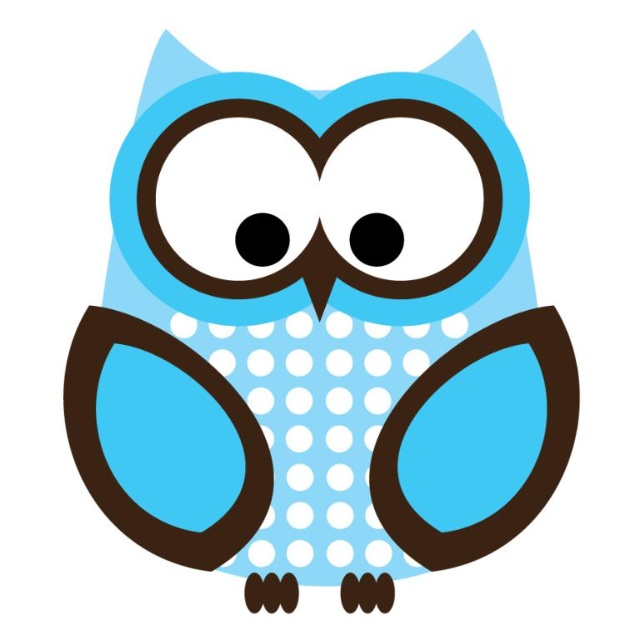
You are designing a sticker for a notebook. The sticker must fit within a 3 inch diameter circle. You have two black elements on it, a black matte circle at center and a black glossy eye at center. Based on the image, will the distance between these two elements exceed the maximum allowable distance of 2.5 inches for the design to be clear?

The distance between the black matte circle at center and the black glossy eye at center is 2.49 inches, which is under the 2.5 inch limit. Therefore, the design meets the clarity requirement.